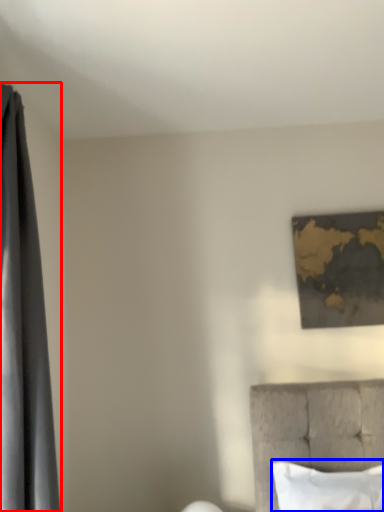
Question: Among these objects, which one is nearest to the camera, curtain (highlighted by a red box) or pillow (highlighted by a blue box)?

Choices:
 (A) curtain
 (B) pillow

Answer: (A)